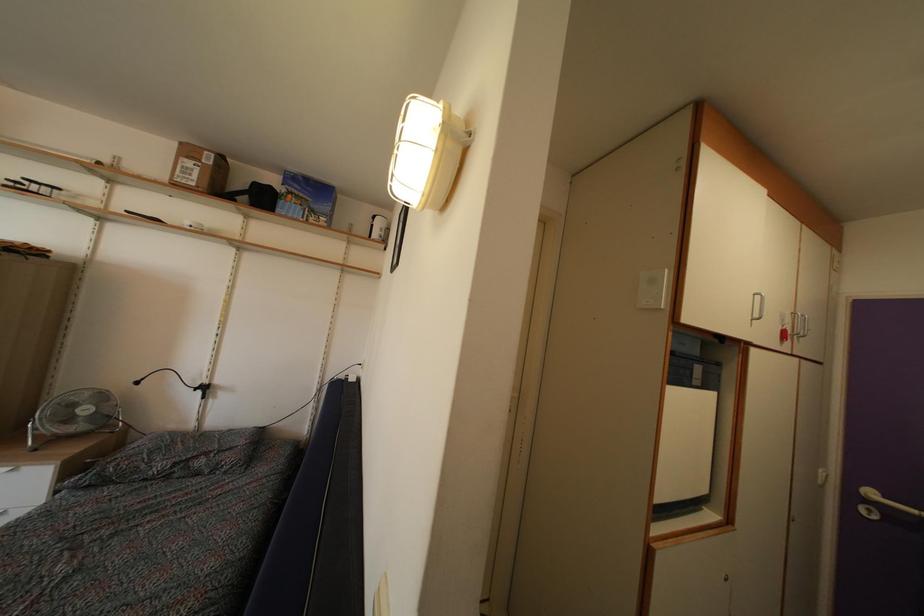
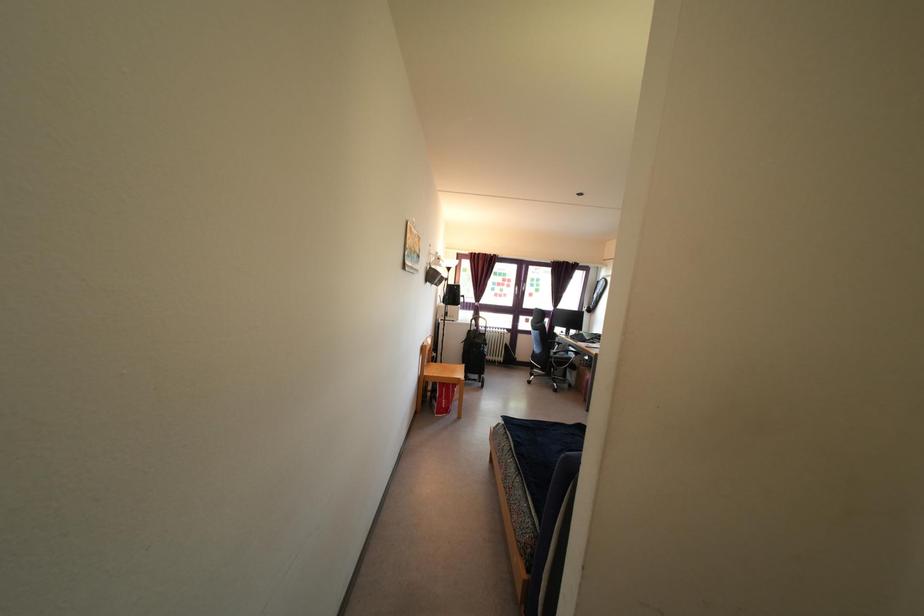
Question: The camera is either moving clockwise (left) or counter-clockwise (right) around the object. The first image is from the beginning of the video and the second image is from the end. Is the camera moving left or right when shooting the video?

Choices:
 (A) Left
 (B) Right

Answer: (B)